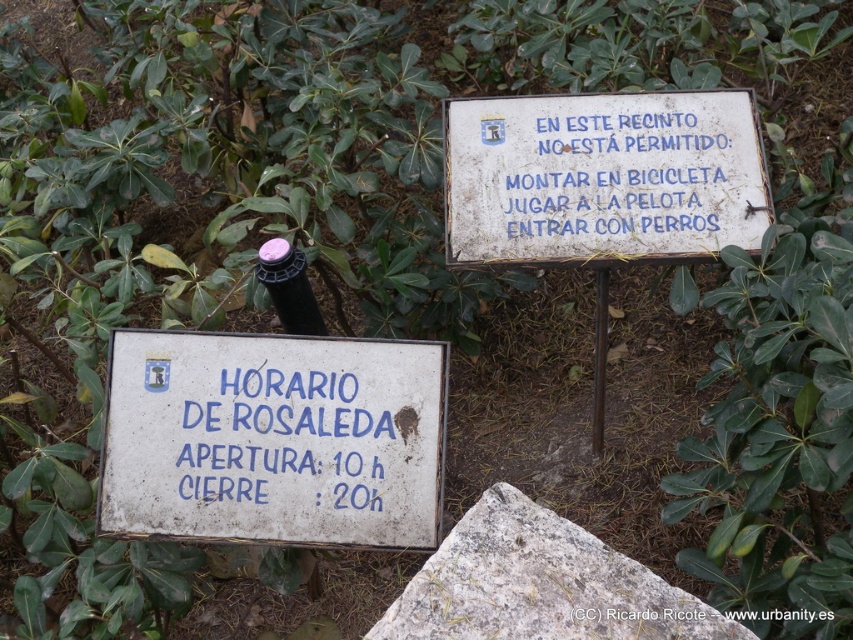
What is the significance of the point at coordinates (602, 177) on the right sign?

The point at coordinates (602, 177) on the right sign is located on the white painted wood sign at upper center, indicating its position on the sign.

You are a tourist holding a map and standing in front of the two signs. You need to determine which of the two points, point (194, 509) or point (521, 513), is closer to you. Which one is closer?

Point (194, 509) is closer to you because it is further to the viewer than point (521, 513).

You are a tourist visiting Rosaleda and want to place your backpack on a stable surface. Which object between the white painted wood sign at upper center and the gray granite stone at center would be more suitable for placing your backpack?

The gray granite stone at center is behind the white painted wood sign at upper center, so the gray granite stone at center is a better option for placing your backpack as it is more likely to be a stable surface.